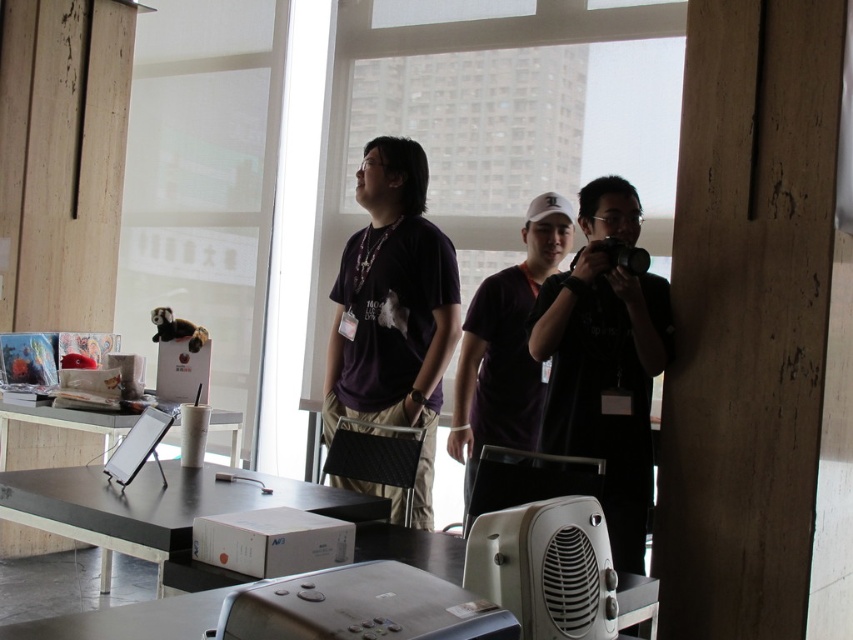
Consider the image. You are standing in the office scene described. You need to reach a specific point marked at coordinates point (363,204). If you are currently 10.01 feet away from this point, can you estimate whether you can comfortably walk to it without needing to move any furniture?

The point (363,204) is 10.01 feet away from you. Since the distance is relatively large, you should be able to walk to it comfortably without needing to move any furniture, as 10 feet is a reasonable distance for navigation in an office space.

You are standing in the office scene described. You need to locate the matte black shirt at center. According to the coordinates provided, where exactly is it positioned in the image?

The matte black shirt at center is positioned at the 2D coordinates point (393, 308) in the image.

You are a delivery person who needs to place a package between the matte black shirt at center and the slate gray plastic projector at lower center. The package requires a space of at least 1.8 meters. Can you fit it there?

The distance between the matte black shirt at center and the slate gray plastic projector at lower center is 1.76 meters, which is slightly less than the required 1.8 meters. Therefore, the package cannot be placed there.